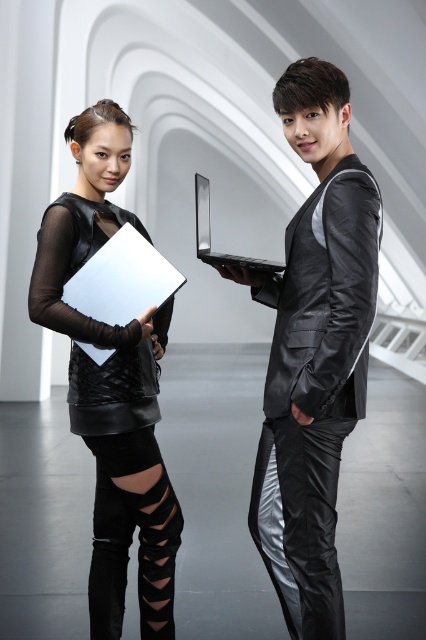
Question: Which point is farther to the camera?

Choices:
 (A) (89, 200)
 (B) (101, 244)
 (C) (201, 195)

Answer: (C)

Question: Can you confirm if matte black dress at left is bigger than silver metallic laptop at center?

Choices:
 (A) no
 (B) yes

Answer: (B)

Question: Which point is closer to the camera?

Choices:
 (A) (123, 419)
 (B) (282, 465)
 (C) (242, 259)

Answer: (B)

Question: Which point appears farthest from the camera in this image?

Choices:
 (A) (146, 468)
 (B) (152, 292)
 (C) (40, 298)
 (D) (278, 452)

Answer: (B)

Question: Is matte black dress at left smaller than black leather dress at left?

Choices:
 (A) no
 (B) yes

Answer: (A)

Question: Is black leather dress at left smaller than silver metallic laptop at center?

Choices:
 (A) no
 (B) yes

Answer: (A)